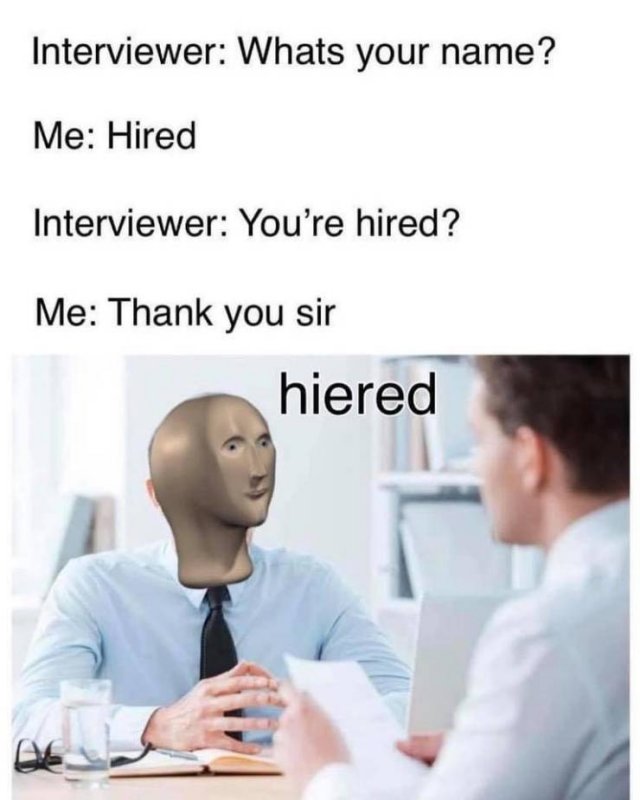
Locate an element on the screen. This screenshot has height=800, width=640. books in the background is located at coordinates (433, 429), (410, 437), (400, 438), (384, 432), (67, 542), (107, 521).